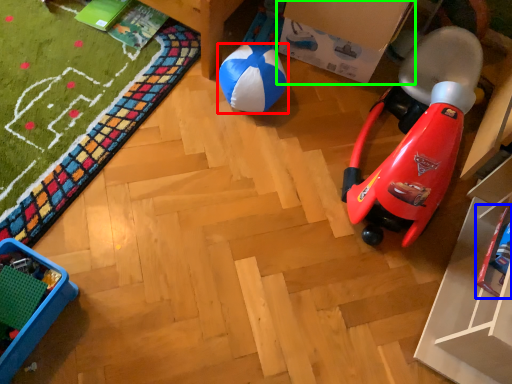
Question: Based on their relative distances, which object is farther from ball (highlighted by a red box)? Choose from toy (highlighted by a blue box) and cardboard box (highlighted by a green box).

Choices:
 (A) toy
 (B) cardboard box

Answer: (A)